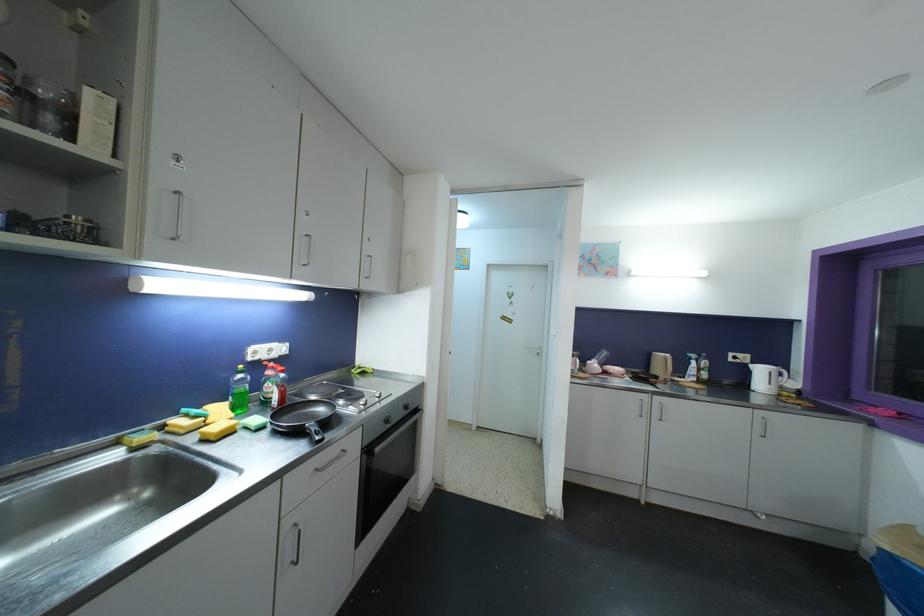
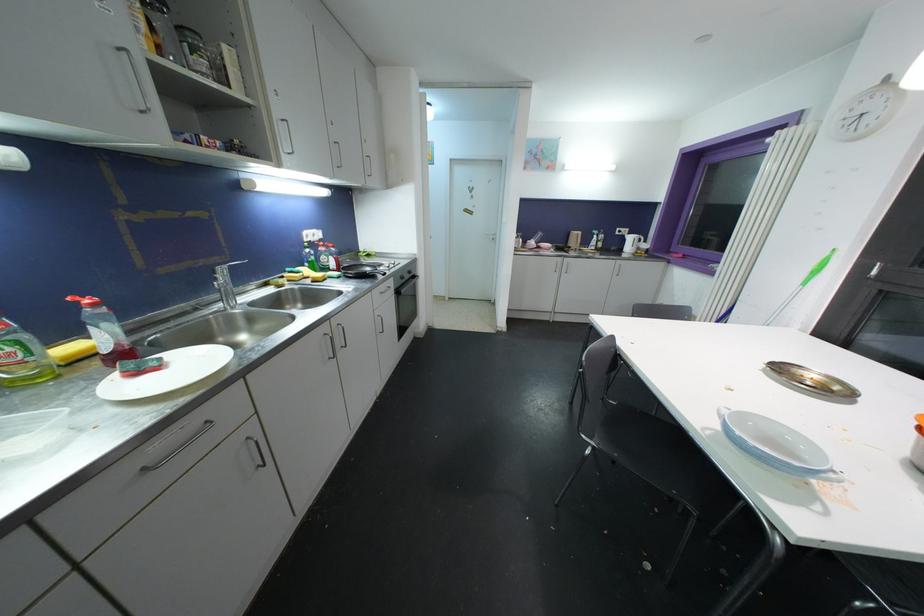
The point at (542, 357) is marked in the first image. Where is the corresponding point in the second image?

(496, 241)